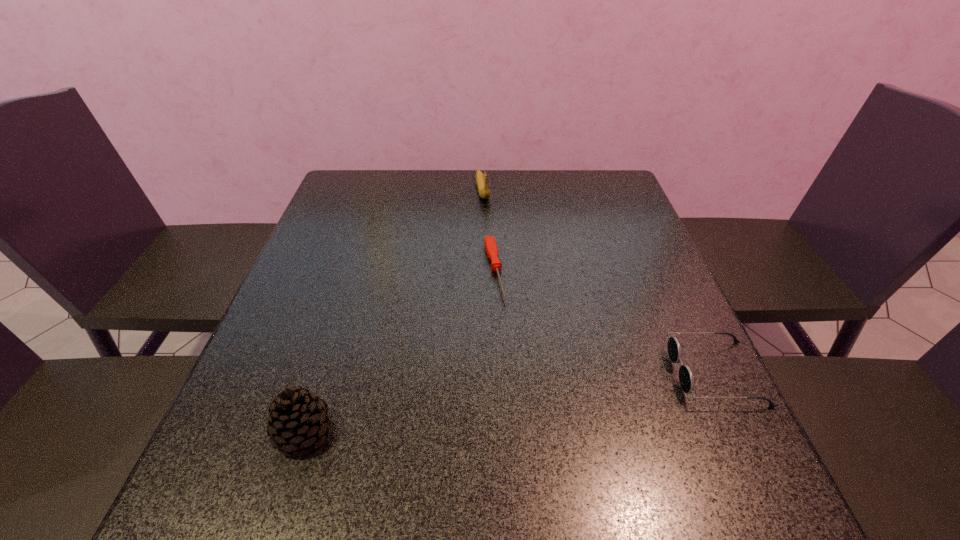
Find the location of a particular element. The image size is (960, 540). vacant space located 0.240m at the stem of the banana is located at coordinates (497, 257).

Find the location of a particular element. The height and width of the screenshot is (540, 960). vacant space situated 0.050m at the stem of the banana is located at coordinates (487, 214).

This screenshot has width=960, height=540. I want to click on vacant position located at the stem of the banana, so click(502, 275).

Find the location of `vacant position located at the tip of the third nearest object`. vacant position located at the tip of the third nearest object is located at coordinates (501, 320).

Identify the location of vacant space located 0.110m at the tip of the third nearest object. Image resolution: width=960 pixels, height=540 pixels. (507, 341).

This screenshot has height=540, width=960. In order to click on vacant space located at the tip of the third nearest object in this screenshot , I will do `click(528, 425)`.

The width and height of the screenshot is (960, 540). I want to click on object situated at the far edge, so click(481, 179).

Where is `pinecone that is at the near edge`? This screenshot has width=960, height=540. pinecone that is at the near edge is located at coordinates (298, 419).

You are a GUI agent. You are given a task and a screenshot of the screen. Output one action in this format:
    pyautogui.click(x=<x>, y=<y>)
    Task: Click on the sunglasses present at the near edge
    
    Given the screenshot: What is the action you would take?
    pyautogui.click(x=686, y=378)

In order to click on object located in the left edge section of the desktop in this screenshot , I will do `click(298, 419)`.